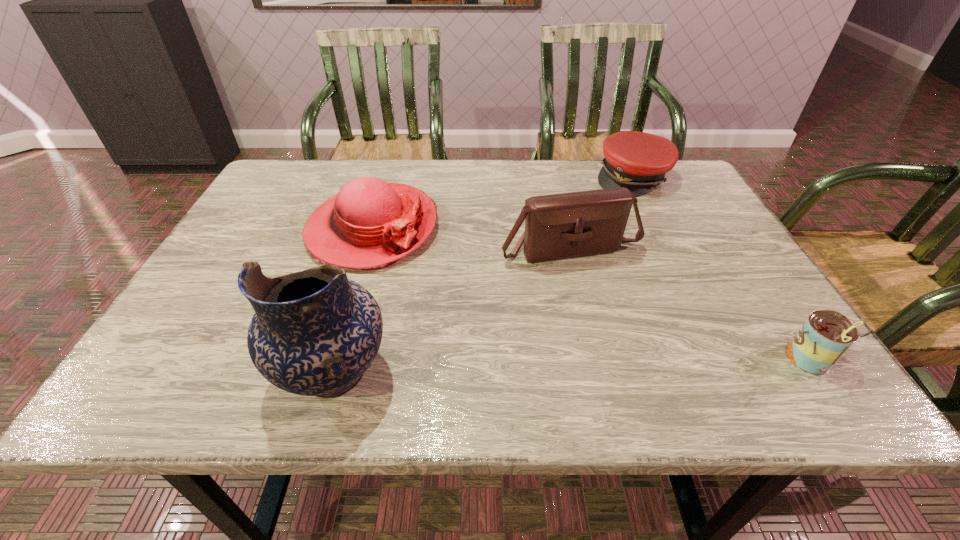
At what (x,y) coordinates should I click in order to perform the action: click on free space between the fourth shortest object and the tallest object. Please return your answer as a coordinate pair (x, y). The width and height of the screenshot is (960, 540). Looking at the image, I should click on pyautogui.click(x=452, y=311).

Image resolution: width=960 pixels, height=540 pixels. Identify the location of free space between the can and the shortest object. tap(720, 268).

At what (x,y) coordinates should I click in order to perform the action: click on vacant area between the fourth shortest object and the hat. Please return your answer as a coordinate pair (x, y). This screenshot has height=540, width=960. Looking at the image, I should click on (471, 238).

Where is `free spot between the second tallest object and the hat`? The width and height of the screenshot is (960, 540). free spot between the second tallest object and the hat is located at coordinates (471, 238).

The width and height of the screenshot is (960, 540). Find the location of `unoccupied area between the cap and the hat`. unoccupied area between the cap and the hat is located at coordinates (502, 203).

Find the location of a particular element. This screenshot has width=960, height=540. unoccupied area between the tallest object and the can is located at coordinates (570, 366).

This screenshot has height=540, width=960. I want to click on vacant region between the pottery and the shortest object, so click(483, 275).

Find the location of a particular element. empty space between the hat and the can is located at coordinates (589, 294).

This screenshot has width=960, height=540. I want to click on object that is the third closest to the shoulder bag, so click(x=826, y=335).

At what (x,y) coordinates should I click in order to perform the action: click on object that is the closest to the can. Please return your answer as a coordinate pair (x, y). The image size is (960, 540). Looking at the image, I should click on (568, 225).